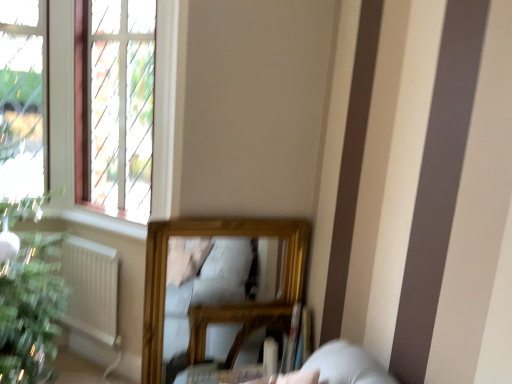
Question: Looking at their shapes, would you say white matte radiator at lower left is wider or thinner than wooden table at lower center?

Choices:
 (A) thin
 (B) wide

Answer: (A)

Question: From the image's perspective, is white matte radiator at lower left located above or below wooden table at lower center?

Choices:
 (A) below
 (B) above

Answer: (B)

Question: Which of these objects is positioned farthest from the clear glass window at upper left?

Choices:
 (A) white matte radiator at lower left
 (B) green matte houseplant at lower left
 (C) wooden table at lower center

Answer: (C)

Question: Considering the real-world distances, which object is farthest from the wooden table at lower center?

Choices:
 (A) white matte radiator at lower left
 (B) green matte houseplant at lower left
 (C) clear glass window at upper left

Answer: (C)